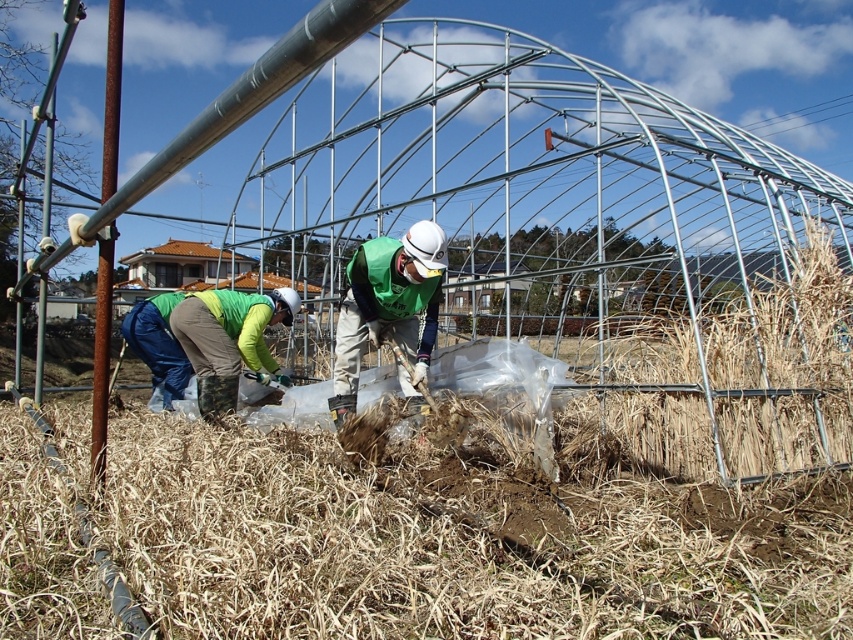
Consider the image. You are a visitor in the greenhouse and want to approach the green fabric jacket at lower left. Which direction should you move relative to the green fabric worker at center?

To reach the green fabric jacket at lower left, you should move behind the green fabric worker at center since the green fabric worker at center is in front of the green fabric jacket at lower left.

You are a visitor in the greenhouse and want to find the green fabric jacket at lower left. Where should you look relative to the green fabric worker at center?

The green fabric worker at center is positioned over the green fabric jacket at lower left, so you should look directly below the green fabric worker at center to find the green fabric jacket at lower left.